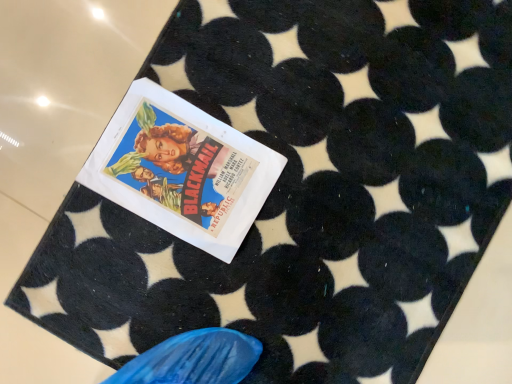
Locate an element on the screen. The image size is (512, 384). white paper poster at center is located at coordinates click(182, 169).

In order to face white paper poster at center, should I rotate leftwards or rightwards?

A 9.529 degree turn to the left will do.

Describe the element at coordinates (182, 169) in the screenshot. I see `white paper poster at center` at that location.

Locate an element on the screen. This screenshot has width=512, height=384. white paper poster at center is located at coordinates (182, 169).